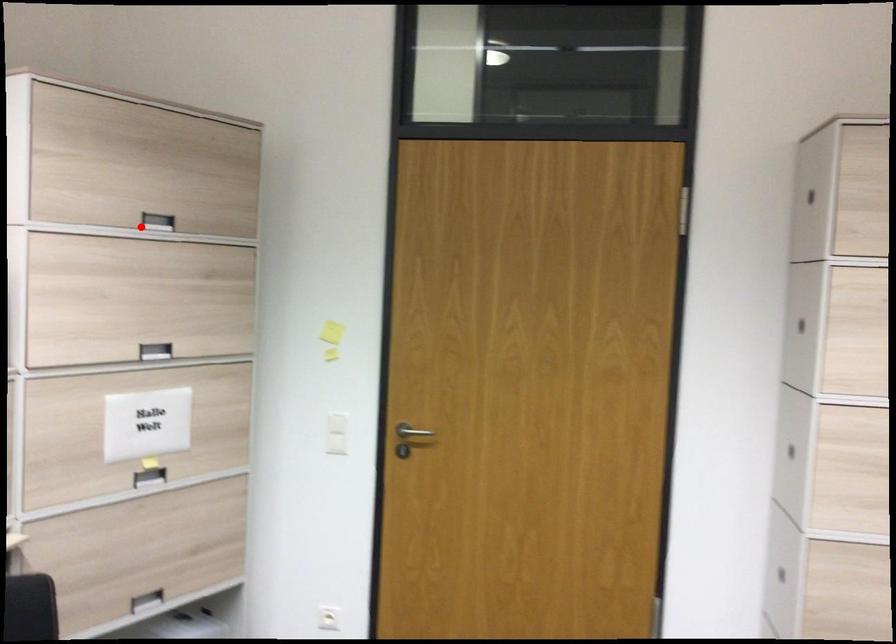
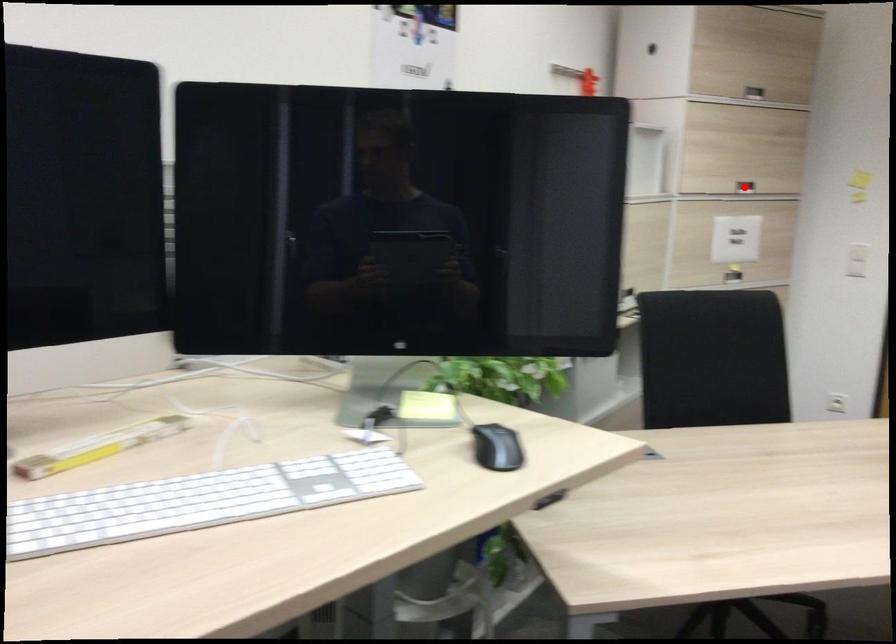
I am providing you with two images of the same scene from different viewpoints. A red point is marked on the first image and another point is marked on the second image. Is the red point in image1 aligned with the point shown in image2?

No